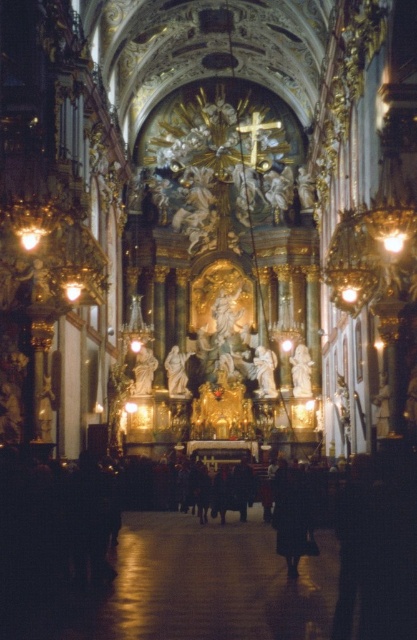
Is dark matte coat at center shorter than white marble statue at center?

Yes.

Can you confirm if dark matte coat at center is taller than white marble statue at center?

In fact, dark matte coat at center may be shorter than white marble statue at center.

Is point (288, 561) closer to camera compared to point (170, 358)?

Yes, point (288, 561) is in front of point (170, 358).

This screenshot has height=640, width=417. What are the coordinates of `dark matte coat at center` in the screenshot? It's located at (291, 515).